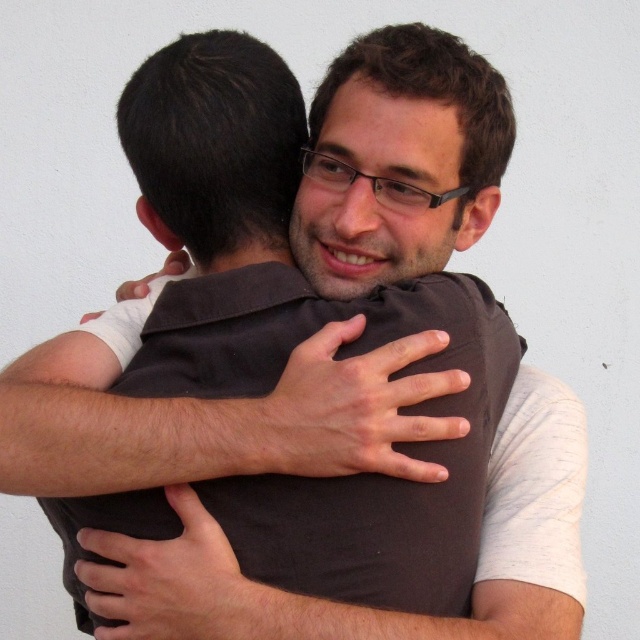
Which is above, brown fabric arm at center or dark brown fabric at center?

brown fabric arm at center is higher up.

Is brown fabric arm at center to the right of dark brown fabric at center from the viewer's perspective?

Incorrect, brown fabric arm at center is not on the right side of dark brown fabric at center.

Which is in front, point (214, 451) or point (179, 547)?

Point (214, 451)

Find the location of a particular element. This screenshot has height=640, width=640. brown fabric arm at center is located at coordinates (214, 419).